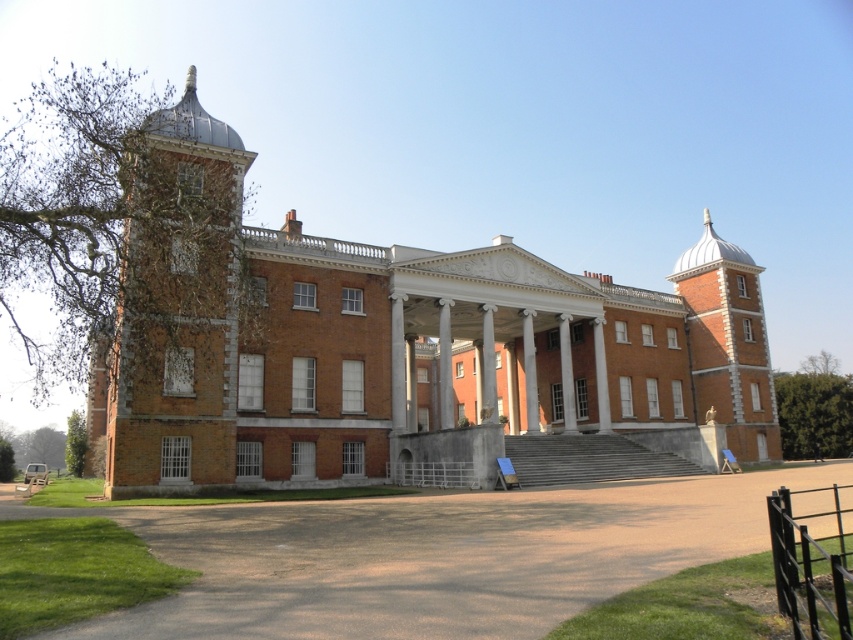
You are standing in front of the grand historic building and want to reach the entrance. There is a brown gravel driveway at lower center marked by point (434, 556). Which direction should you walk to reach the entrance?

The entrance is located at the central section of the building, which is directly in front of you. Since the brown gravel driveway at lower center is marked by point (434, 556), you should walk straight towards the central section to reach the entrance.

You are a visitor arriving at the historic building and need to park your car. The car requires a space that is at least as large as the brick stonework bell tower at right. Is the brown gravel driveway at lower center suitable for parking your car?

The brown gravel driveway at lower center has a smaller size compared to the brick stonework bell tower at right. Therefore, the driveway is not large enough to accommodate a car that requires a space as big as the bell tower.

You are a delivery driver approaching the building and need to park your truck, which is 15 meters long, between the brown gravel driveway at lower center and the brick stonework bell tower at left. Can you park your truck entirely within this space without overlapping either structure?

The distance between the brown gravel driveway at lower center and the brick stonework bell tower at left is 17.41 meters. Since your truck is 15 meters long, there is enough space to park it entirely within this area without overlapping either structure.